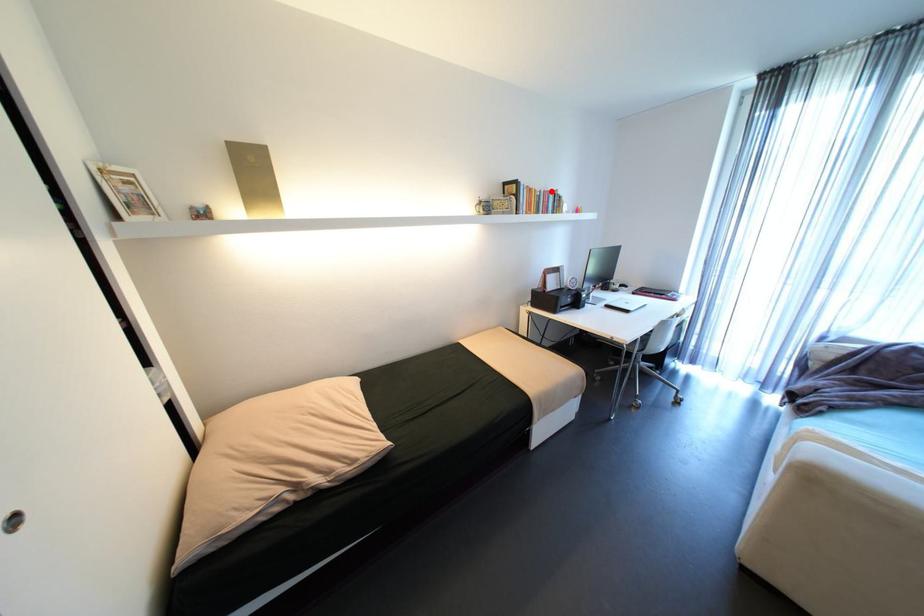
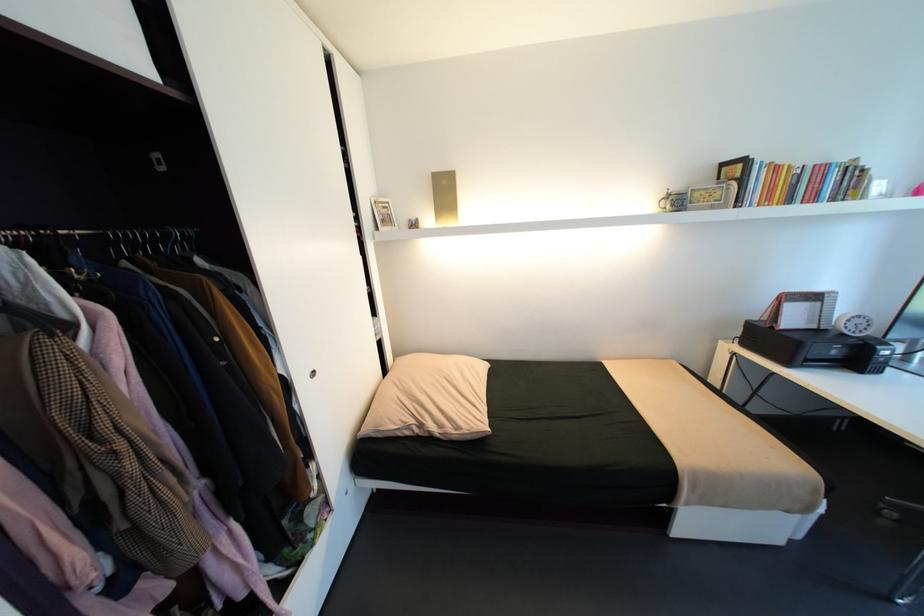
Question: I am providing you with two images of the same scene from different viewpoints. Given a red point in image1, look at the same physical point in image2. Is it:

Choices:
 (A) Closer to the viewpoint
 (B) Farther from the viewpoint

Answer: (B)